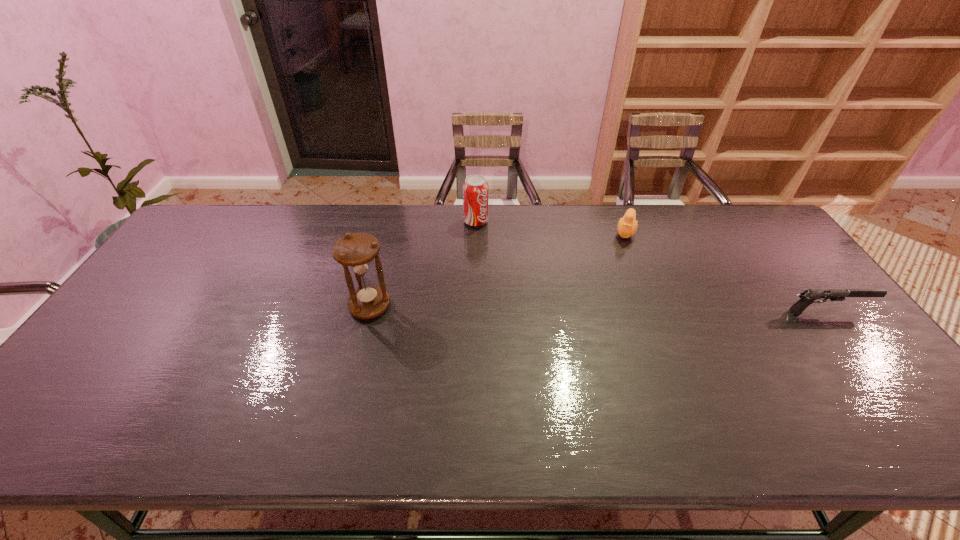
In order to click on vacant space located on the face of the second object from right to left in this screenshot , I will do `click(602, 322)`.

The image size is (960, 540). I want to click on free space located 0.390m on the face of the second object from right to left, so click(x=601, y=324).

This screenshot has width=960, height=540. What are the coordinates of `blank area located on the face of the second object from right to left` in the screenshot? It's located at (612, 286).

Find the location of a particular element. The image size is (960, 540). soda can present at the far edge is located at coordinates pyautogui.click(x=475, y=188).

Find the location of a particular element. This screenshot has width=960, height=540. duckling present at the far edge is located at coordinates (627, 226).

Where is `object positioned at the right edge`? The width and height of the screenshot is (960, 540). object positioned at the right edge is located at coordinates (807, 297).

Identify the location of free space at the far edge of the desktop. The height and width of the screenshot is (540, 960). (701, 239).

Image resolution: width=960 pixels, height=540 pixels. I want to click on free space at the near edge of the desktop, so click(631, 400).

In the image, there is a desktop. Identify the location of vacant region at the left edge. This screenshot has height=540, width=960. (176, 250).

Where is `vacant space at the right edge of the desktop`? The height and width of the screenshot is (540, 960). vacant space at the right edge of the desktop is located at coordinates (766, 261).